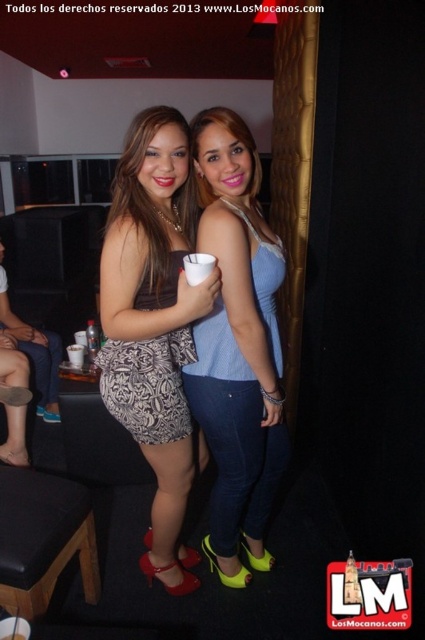
You are a photographer standing at the entrance of the venue. You want to take a picture of the patterned fabric skirt at center without moving closer than 4 feet. Is the current distance sufficient?

The patterned fabric skirt at center is 4.16 feet away from the viewer, which is slightly beyond the 4 feet minimum distance required. Therefore, the current distance is sufficient to take the picture without moving closer.